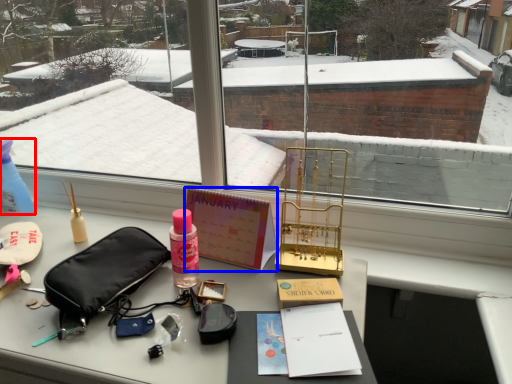
Question: Among these objects, which one is farthest to the camera, bottle (highlighted by a red box) or book (highlighted by a blue box)?

Choices:
 (A) bottle
 (B) book

Answer: (A)